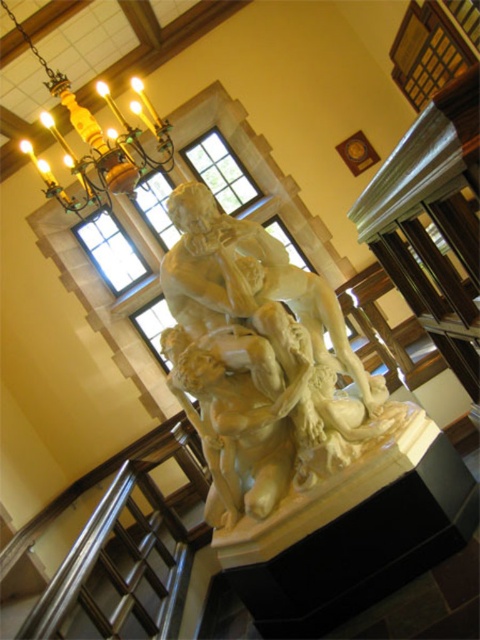
Is white marble sculpture at center to the left of gold polished metal chandelier at upper left from the viewer's perspective?

No, white marble sculpture at center is not to the left of gold polished metal chandelier at upper left.

I want to click on white marble sculpture at center, so click(260, 362).

The width and height of the screenshot is (480, 640). I want to click on white marble sculpture at center, so click(260, 362).

Locate an element on the screen. The image size is (480, 640). white marble sculpture at center is located at coordinates (260, 362).